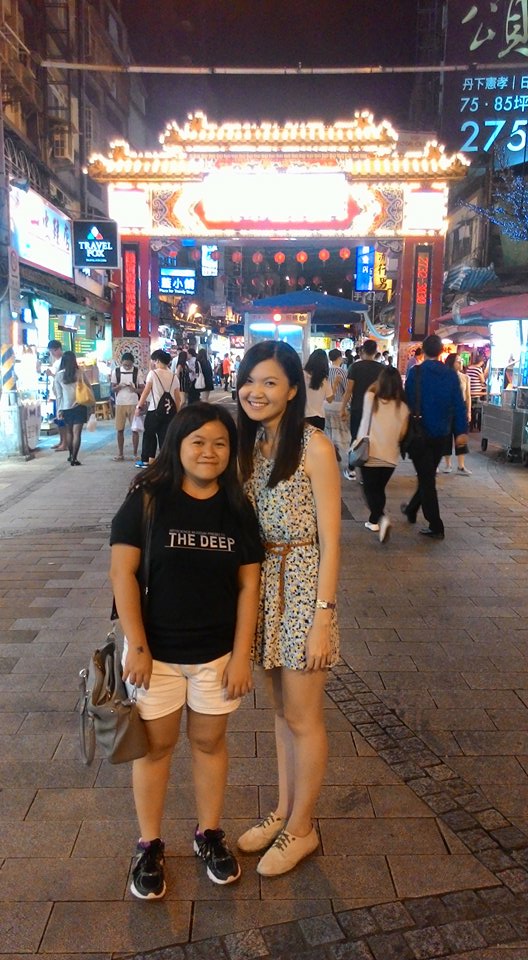
Locate an element on the screen. lit up decorative sign is located at coordinates (279, 132), (168, 155), (293, 202), (420, 203).